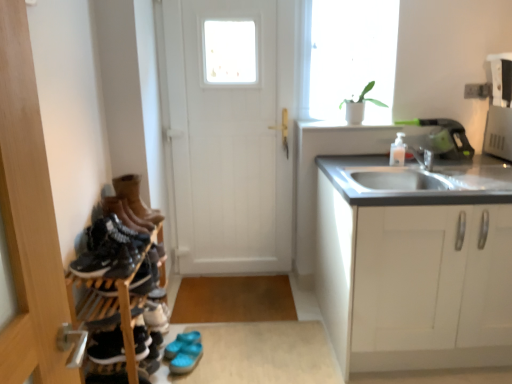
Question: Is leather boots at left, acting as the 1th footwear starting from the top, to the left or to the right of black matte shoe at left, the 3th shoe ordered from the bottom, in the image?

Choices:
 (A) left
 (B) right

Answer: (A)

Question: Considering the positions of leather boots at left, acting as the 1th footwear starting from the top, and black matte shoe at left, the 3th shoe ordered from the bottom, in the image, is leather boots at left, acting as the 1th footwear starting from the top, bigger or smaller than black matte shoe at left, the 3th shoe ordered from the bottom,?

Choices:
 (A) big
 (B) small

Answer: (A)

Question: Which object is the closest to the matte black sneaker at left, which is the 3th shoe from front to back?

Choices:
 (A) leather boots at left, which appears as the second footwear when viewed from the back
 (B) black leather shoe at left, acting as the 3th shoe starting from the top
 (C) black matte shoe at left, the 3th shoe ordered from the bottom
 (D) black suede sneakers at lower left, the 1th footwear positioned from the front
 (E) transparent glass window at upper center

Answer: (B)

Question: Estimate the real-world distances between objects in this image. Which object is closer to the leather boots at left, which ranks as the 3th footwear in back-to-front order?

Choices:
 (A) white matte cabinet at right
 (B) wooden shoe rack at left
 (C) black suede sneakers at lower left, the fourth footwear when ordered from back to front
 (D) blue rubber sandals at lower center, the 1th footwear in the back-to-front sequence
 (E) black matte shoe at left, which is the third shoe from back to front

Answer: (E)